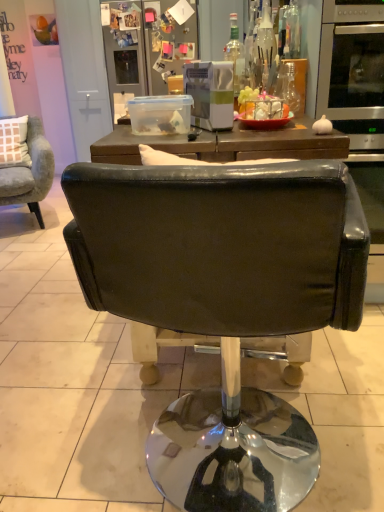
Question: Considering the relative positions of transparent glass bottle at upper center, the second bottle when ordered from left to right, and transparent glass bottle at upper right, which ranks as the third bottle in left-to-right order, in the image provided, is transparent glass bottle at upper center, the second bottle when ordered from left to right, to the left of transparent glass bottle at upper right, which ranks as the third bottle in left-to-right order, from the viewer's perspective?

Choices:
 (A) no
 (B) yes

Answer: (B)

Question: From a real-world perspective, does transparent glass bottle at upper center, the 3th bottle when ordered from right to left, stand above transparent glass bottle at upper right, which ranks as the third bottle in left-to-right order?

Choices:
 (A) no
 (B) yes

Answer: (B)

Question: Is transparent glass bottle at upper center, the second bottle when ordered from left to right, taller than transparent glass bottle at upper right, which ranks as the third bottle in left-to-right order?

Choices:
 (A) no
 (B) yes

Answer: (B)

Question: From the image's perspective, is transparent glass bottle at upper center, the second bottle when ordered from left to right, located above transparent glass bottle at upper right, which is counted as the second bottle, starting from the right?

Choices:
 (A) no
 (B) yes

Answer: (B)

Question: Would you say transparent glass bottle at upper center, the 3th bottle when ordered from right to left, is a long distance from transparent glass bottle at upper right, which is counted as the second bottle, starting from the right?

Choices:
 (A) yes
 (B) no

Answer: (B)

Question: From their relative heights in the image, would you say black leather chair at center, which is counted as the 1th chair, starting from the front, is taller or shorter than transparent glass bottle at upper right, which is counted as the fourth bottle, starting from the left?

Choices:
 (A) short
 (B) tall

Answer: (B)

Question: From a real-world perspective, is black leather chair at center, positioned as the 1th chair in bottom-to-top order, above or below transparent glass bottle at upper right, the 1th bottle in the right-to-left sequence?

Choices:
 (A) above
 (B) below

Answer: (B)

Question: Do you think black leather chair at center, positioned as the 1th chair in bottom-to-top order, is within transparent glass bottle at upper right, which is counted as the fourth bottle, starting from the left, or outside of it?

Choices:
 (A) inside
 (B) outside

Answer: (B)

Question: In terms of size, does black leather chair at center, which is counted as the 1th chair, starting from the front, appear bigger or smaller than transparent glass bottle at upper right, which is counted as the fourth bottle, starting from the left?

Choices:
 (A) small
 (B) big

Answer: (B)

Question: Relative to metallic silver refrigerator at upper center, is velvet grey armchair at left, positioned as the 1th chair in back-to-front order, in front or behind?

Choices:
 (A) behind
 (B) front

Answer: (B)

Question: Visually, is velvet grey armchair at left, the first chair from the left, positioned to the left or to the right of metallic silver refrigerator at upper center?

Choices:
 (A) left
 (B) right

Answer: (A)

Question: Looking at the image, does velvet grey armchair at left, the first chair from the left, seem bigger or smaller compared to metallic silver refrigerator at upper center?

Choices:
 (A) big
 (B) small

Answer: (A)

Question: Does point (36, 190) appear closer or farther from the camera than point (193, 53)?

Choices:
 (A) closer
 (B) farther

Answer: (A)

Question: Considering the positions of metallic silver refrigerator at upper center and transparent glass bottle at upper right, which is counted as the second bottle, starting from the right, in the image, is metallic silver refrigerator at upper center wider or thinner than transparent glass bottle at upper right, which is counted as the second bottle, starting from the right,?

Choices:
 (A) thin
 (B) wide

Answer: (B)

Question: Is point (105, 53) positioned closer to the camera than point (276, 94)?

Choices:
 (A) closer
 (B) farther

Answer: (B)